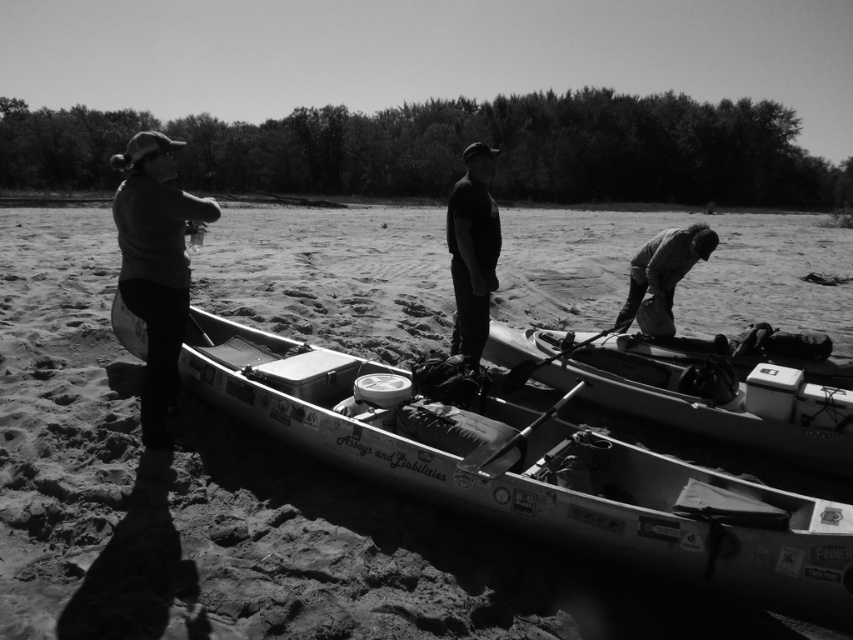
Question: Is dark gray sweater at left to the right of dark fabric jacket at lower right from the viewer's perspective?

Choices:
 (A) no
 (B) yes

Answer: (A)

Question: Can you confirm if smooth plastic canoe at center is positioned below black matte shirt at center?

Choices:
 (A) yes
 (B) no

Answer: (A)

Question: Can you confirm if metallic kayak at center is positioned above dark gray sweater at left?

Choices:
 (A) no
 (B) yes

Answer: (A)

Question: Considering the real-world distances, which object is closest to the dark gray sweater at left?

Choices:
 (A) dark fabric jacket at lower right
 (B) black matte shirt at center
 (C) smooth plastic canoe at center

Answer: (B)

Question: Which object is closer to the camera taking this photo?

Choices:
 (A) metallic kayak at center
 (B) smooth plastic canoe at center

Answer: (A)

Question: Which point is farther to the camera?

Choices:
 (A) (764, 576)
 (B) (451, 262)

Answer: (B)